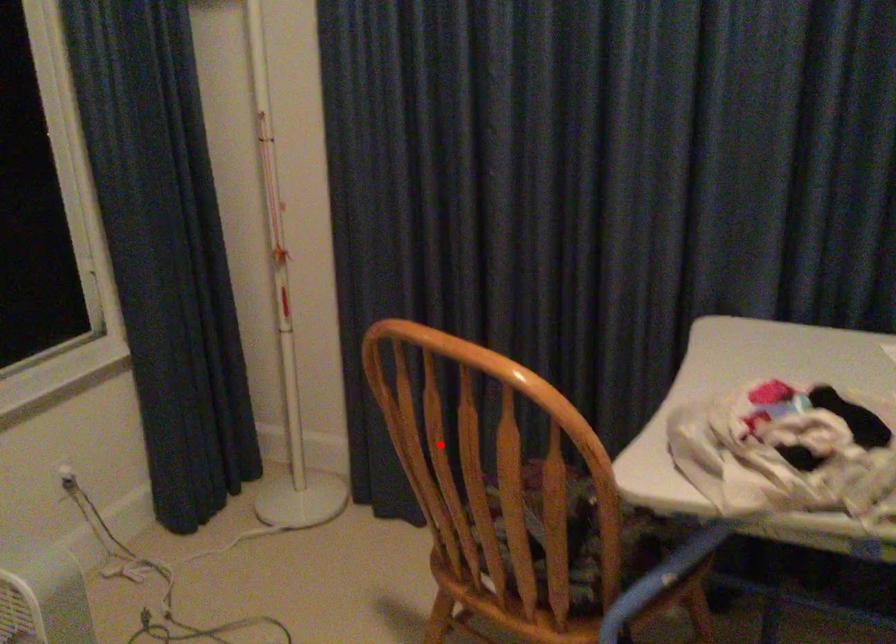
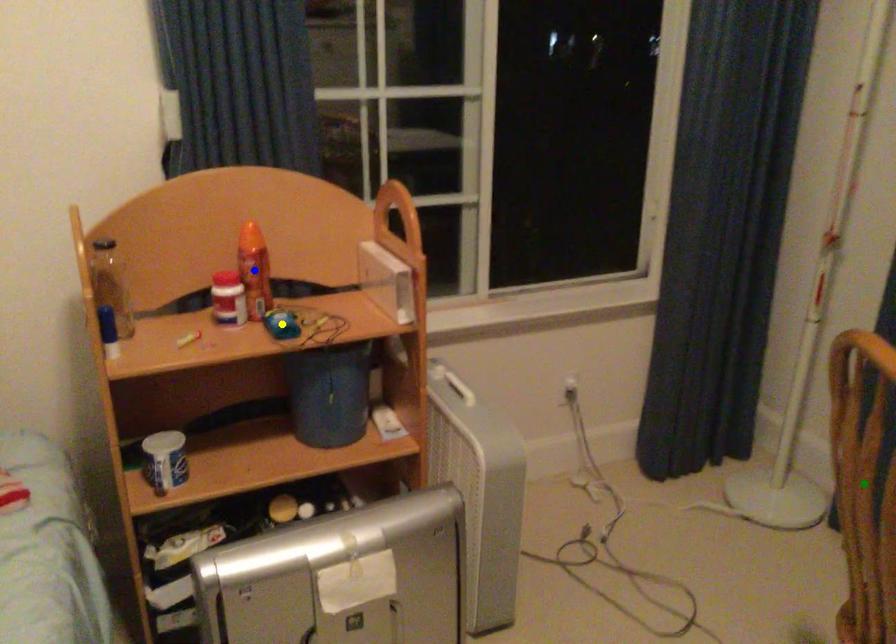
Question: I am providing you with two images of the same scene from different viewpoints. A red point is marked on the first image. You are given multiple points on the second image. Can you choose the point in image 2 that corresponds to the point in image 1?

Choices:
 (A) blue point
 (B) green point
 (C) yellow point

Answer: (B)